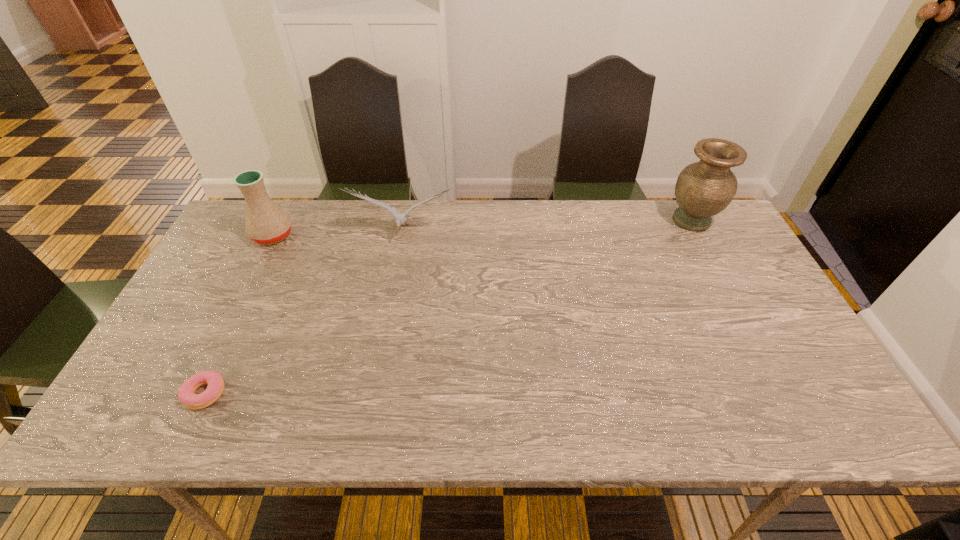
Identify the location of free space located on the right of the shortest object. This screenshot has width=960, height=540. (274, 394).

At what (x,y) coordinates should I click in order to perform the action: click on vase that is at the far edge. Please return your answer as a coordinate pair (x, y). The height and width of the screenshot is (540, 960). Looking at the image, I should click on (703, 189).

The height and width of the screenshot is (540, 960). Identify the location of pottery present at the far edge. (266, 223).

Image resolution: width=960 pixels, height=540 pixels. What are the coordinates of `gull located at the far edge` in the screenshot? It's located at pos(400,219).

Identify the location of object that is at the near edge. (186, 394).

At what (x,y) coordinates should I click in order to perform the action: click on pottery at the left edge. Please return your answer as a coordinate pair (x, y). The width and height of the screenshot is (960, 540). Looking at the image, I should click on (266, 223).

The height and width of the screenshot is (540, 960). Identify the location of doughnut located at the left edge. (186, 394).

Image resolution: width=960 pixels, height=540 pixels. What are the coordinates of `object located in the right edge section of the desktop` in the screenshot? It's located at (703, 189).

This screenshot has height=540, width=960. In order to click on object located at the far left corner in this screenshot , I will do `click(266, 223)`.

The height and width of the screenshot is (540, 960). I want to click on object that is at the near left corner, so click(186, 394).